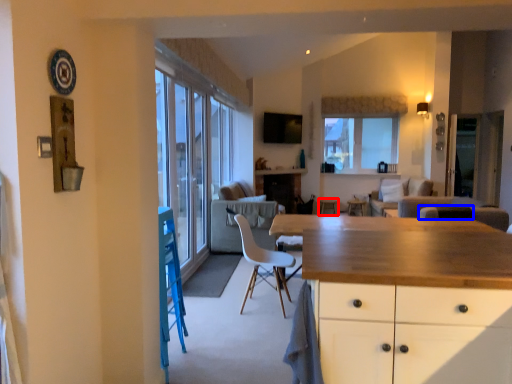
Question: Which point is closer to the camera, bar stool (highlighted by a red box) or armchair (highlighted by a blue box)?

Choices:
 (A) bar stool
 (B) armchair

Answer: (B)